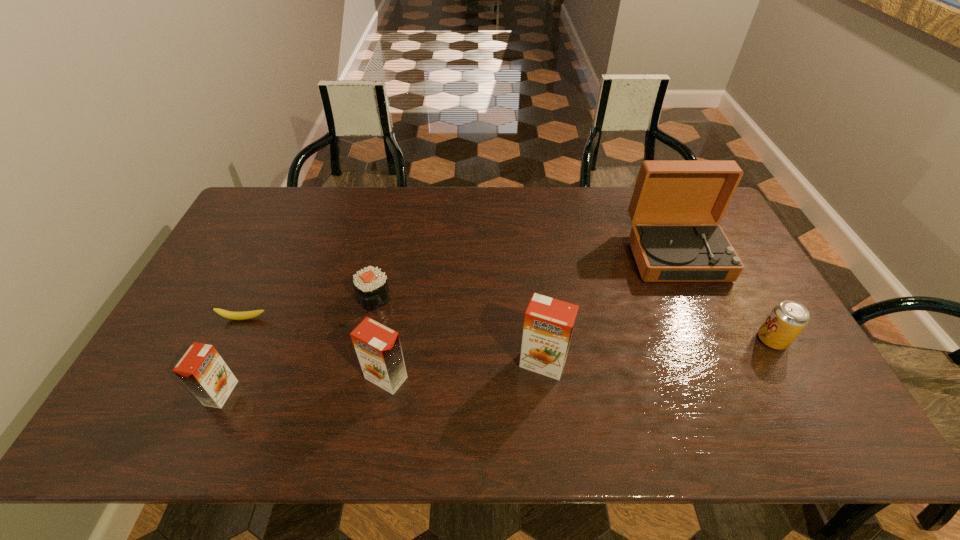
Please point a free position for a orange juice on the right. Please provide its 2D coordinates. Your answer should be formatted as a tuple, i.e. [(x, y)], where the tuple contains the x and y coordinates of a point satisfying the conditions above.

[(691, 349)]